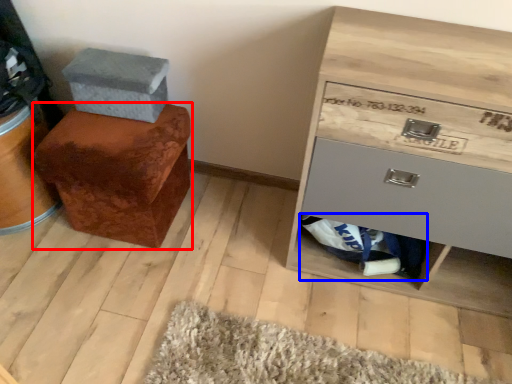
Question: Which point is closer to the camera, furniture (highlighted by a red box) or material (highlighted by a blue box)?

Choices:
 (A) furniture
 (B) material

Answer: (A)